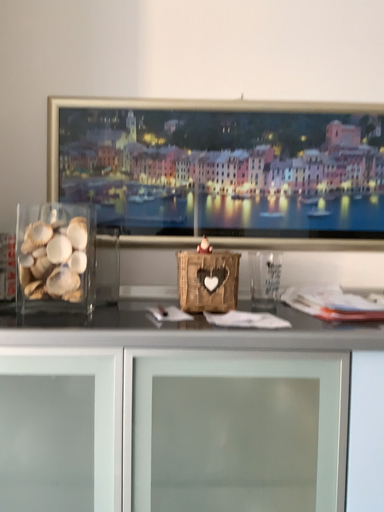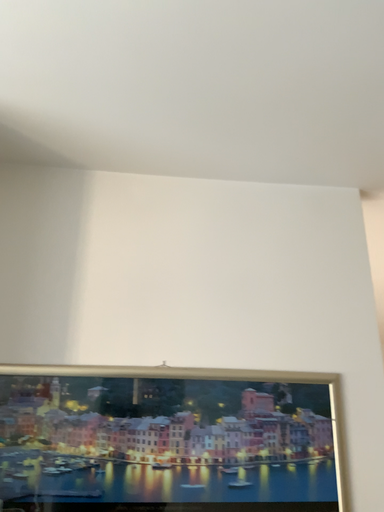
Question: Which way did the camera rotate in the video?

Choices:
 (A) rotated upward
 (B) rotated downward

Answer: (A)